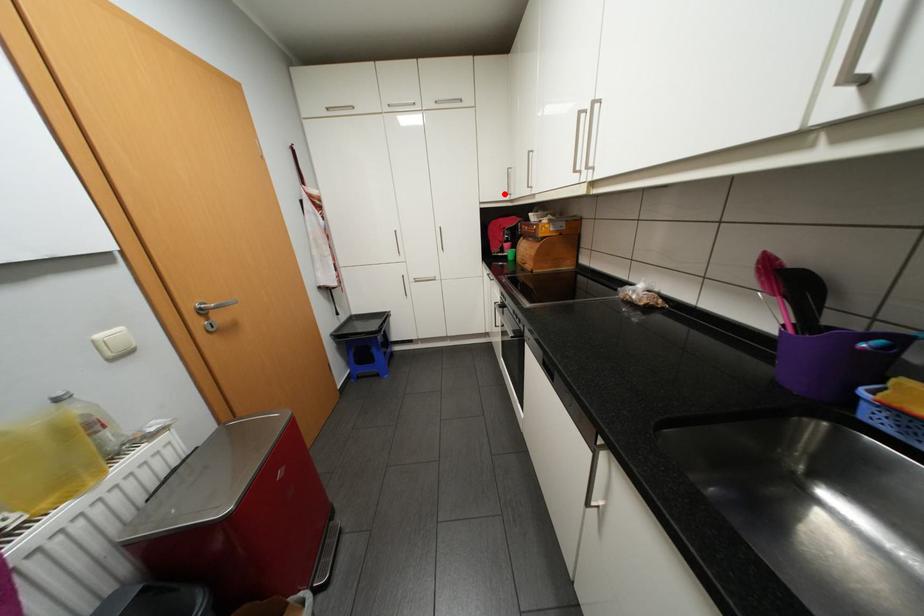
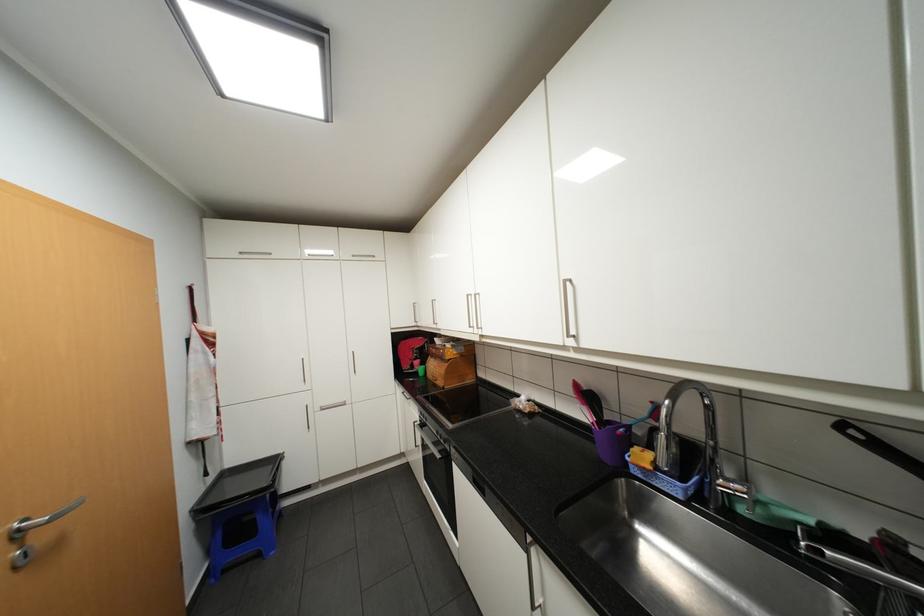
Question: I am providing you with two images of the same scene from different viewpoints. Given a red point in image1, look at the same physical point in image2. Is it:

Choices:
 (A) Closer to the viewpoint
 (B) Farther from the viewpoint

Answer: (B)